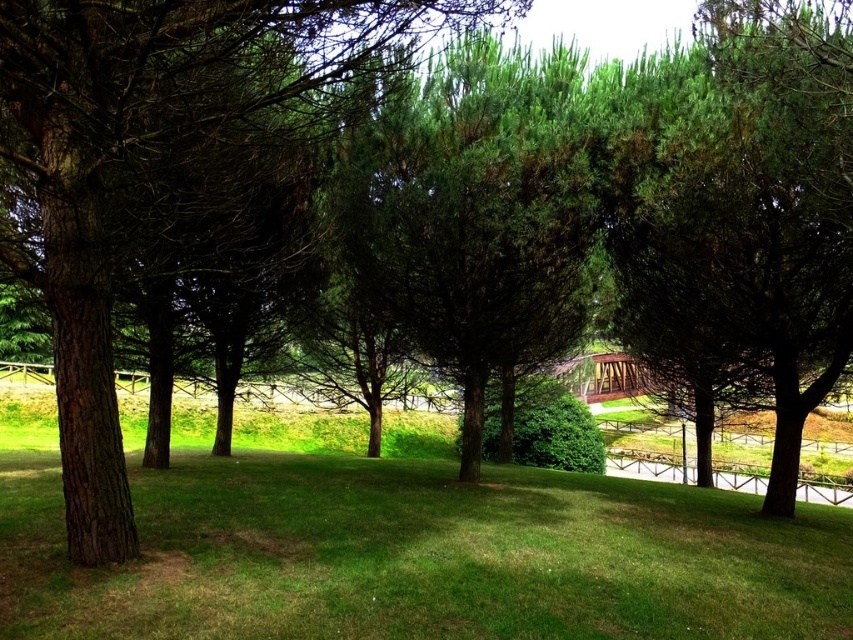
Can you confirm if green grassy at center is positioned above green textured tree at center?

Incorrect, green grassy at center is not positioned above green textured tree at center.

Does point (354, 548) come farther from viewer compared to point (45, 108)?

Yes, it is behind point (45, 108).

What do you see at coordinates (419, 556) in the screenshot? I see `green grassy at center` at bounding box center [419, 556].

I want to click on green grassy at center, so click(419, 556).